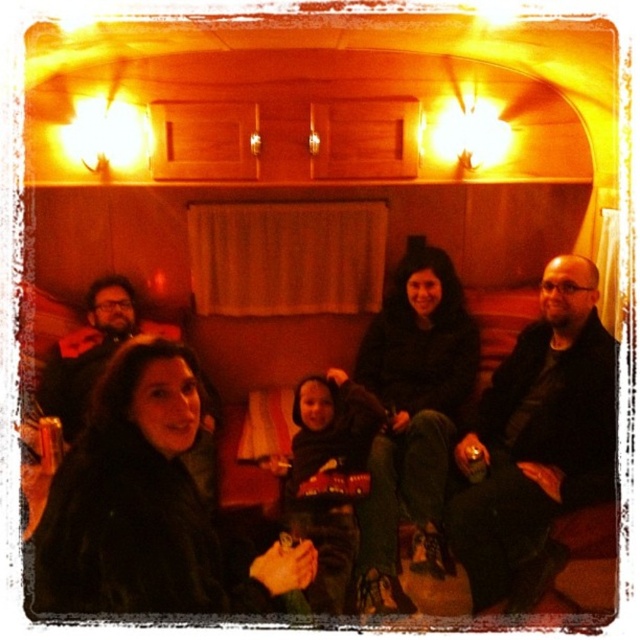
Question: Is black fuzzy sweater at center above matte black jacket at left?

Choices:
 (A) yes
 (B) no

Answer: (B)

Question: Does black fuzzy sweater at center have a smaller size compared to matte black jacket at left?

Choices:
 (A) no
 (B) yes

Answer: (A)

Question: Among these points, which one is farthest from the camera?

Choices:
 (A) (424, 481)
 (B) (516, 586)
 (C) (67, 396)

Answer: (C)

Question: Which object is farther from the camera taking this photo?

Choices:
 (A) black fuzzy coat at lower left
 (B) matte black jacket at left
 (C) black fuzzy sweater at center
 (D) black leather jacket at center

Answer: (B)

Question: Which point is farther from the camera taking this photo?

Choices:
 (A) (250, 592)
 (B) (116, 308)
 (C) (554, 337)
 (D) (424, 467)

Answer: (B)

Question: Is black fuzzy sweater at center to the right of matte black jacket at left from the viewer's perspective?

Choices:
 (A) no
 (B) yes

Answer: (B)